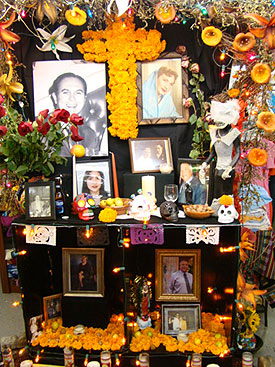
You are a GUI agent. You are given a task and a screenshot of the screen. Output one action in this format:
    pyautogui.click(x=<x>, y=<y>)
    Task: Click on the votive
    
    Given the screenshot: What is the action you would take?
    pyautogui.click(x=250, y=359)